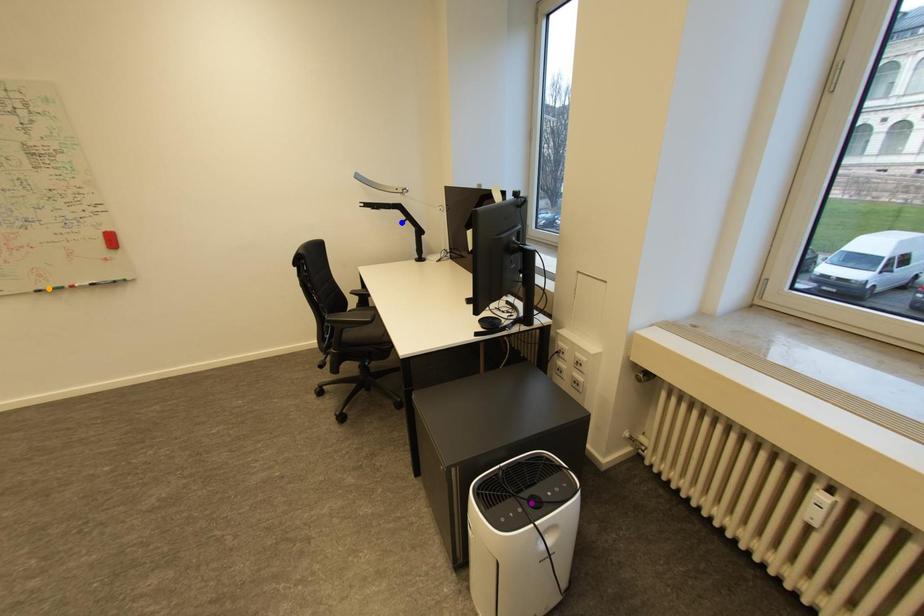
Order these from nearest to farthest:
blue point | purple point | orange point

1. purple point
2. orange point
3. blue point